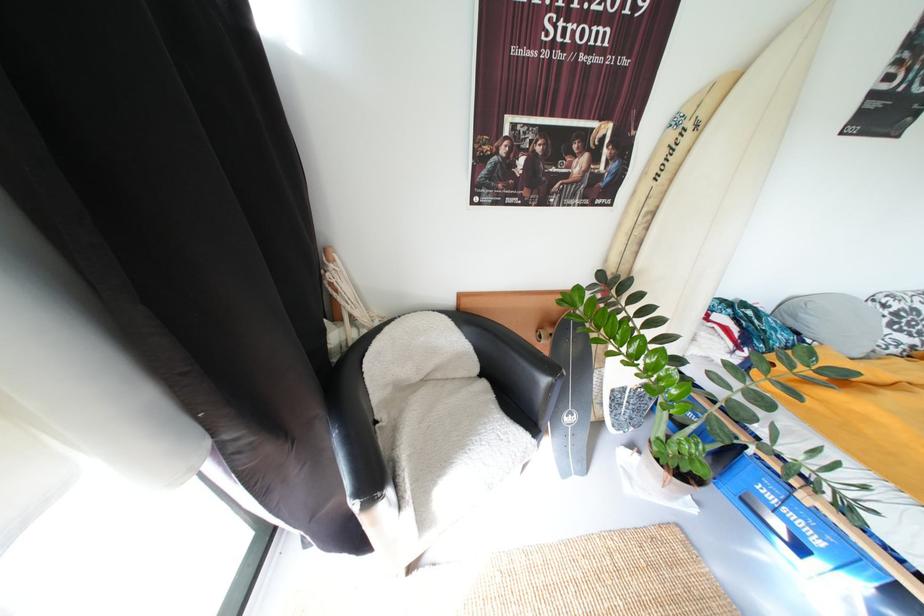
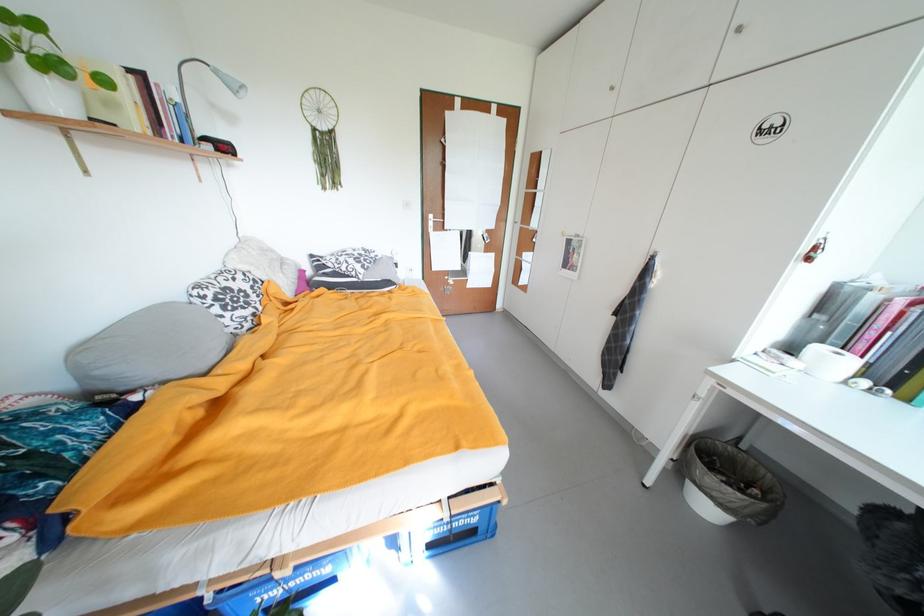
Locate, in the second image, the point that corresponds to (x=809, y=317) in the first image.

(105, 374)